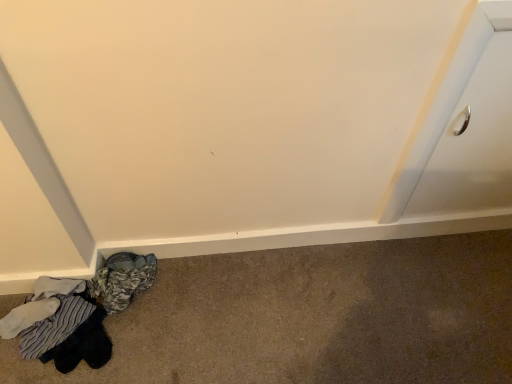
Question: Are white glossy drawer at upper right and striped cotton socks at lower left far apart?

Choices:
 (A) yes
 (B) no

Answer: (B)

Question: From the image's perspective, does white glossy drawer at upper right appear lower than striped cotton socks at lower left?

Choices:
 (A) yes
 (B) no

Answer: (B)

Question: Can you confirm if white glossy drawer at upper right is smaller than striped cotton socks at lower left?

Choices:
 (A) no
 (B) yes

Answer: (B)

Question: From a real-world perspective, is white glossy drawer at upper right below striped cotton socks at lower left?

Choices:
 (A) no
 (B) yes

Answer: (A)

Question: Is white glossy drawer at upper right oriented towards striped cotton socks at lower left?

Choices:
 (A) yes
 (B) no

Answer: (B)

Question: Considering the relative sizes of white glossy drawer at upper right and striped cotton socks at lower left in the image provided, is white glossy drawer at upper right thinner than striped cotton socks at lower left?

Choices:
 (A) yes
 (B) no

Answer: (A)

Question: Is striped cotton socks at lower left beside white glossy drawer at upper right?

Choices:
 (A) yes
 (B) no

Answer: (B)

Question: From the image's perspective, is striped cotton socks at lower left above white glossy drawer at upper right?

Choices:
 (A) no
 (B) yes

Answer: (A)

Question: Is white glossy drawer at upper right located within striped cotton socks at lower left?

Choices:
 (A) yes
 (B) no

Answer: (B)

Question: Considering the relative positions of striped cotton socks at lower left and white glossy drawer at upper right in the image provided, is striped cotton socks at lower left to the right of white glossy drawer at upper right from the viewer's perspective?

Choices:
 (A) yes
 (B) no

Answer: (B)

Question: Is striped cotton socks at lower left aimed at white glossy drawer at upper right?

Choices:
 (A) yes
 (B) no

Answer: (B)

Question: Is striped cotton socks at lower left oriented away from white glossy drawer at upper right?

Choices:
 (A) no
 (B) yes

Answer: (A)

Question: Is striped cotton socks at lower left taller or shorter than white glossy drawer at upper right?

Choices:
 (A) short
 (B) tall

Answer: (A)